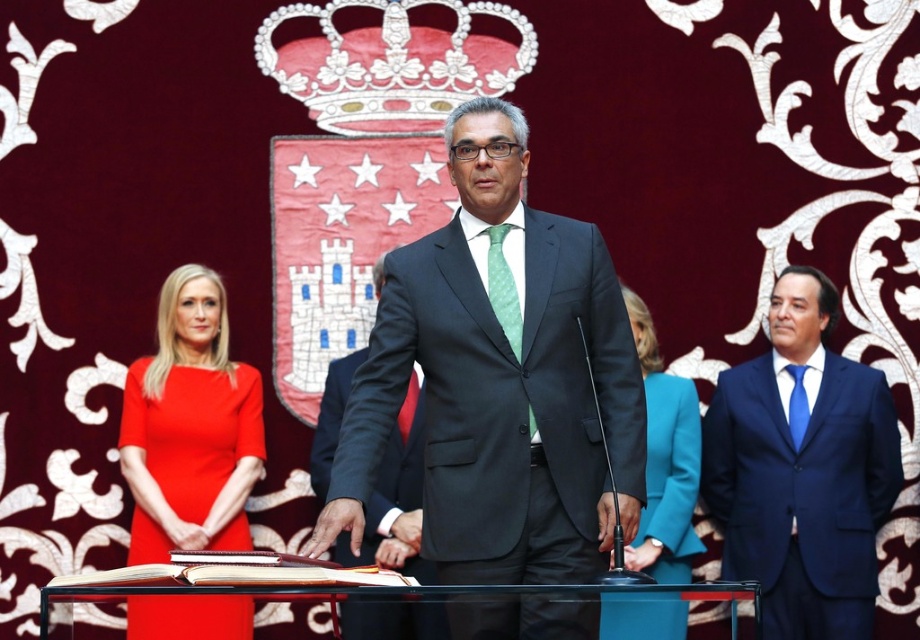
Is blue satin suit at right shorter than teal fabric jacket at lower center?

In fact, blue satin suit at right may be taller than teal fabric jacket at lower center.

How much distance is there between blue satin suit at right and teal fabric jacket at lower center?

A distance of 4.61 meters exists between blue satin suit at right and teal fabric jacket at lower center.

Locate an element on the screen. This screenshot has width=920, height=640. blue satin suit at right is located at coordinates (802, 472).

Locate an element on the screen. The height and width of the screenshot is (640, 920). blue satin suit at right is located at coordinates (802, 472).

Image resolution: width=920 pixels, height=640 pixels. What do you see at coordinates (500, 381) in the screenshot?
I see `matte black suit at center` at bounding box center [500, 381].

Identify the location of matte black suit at center. The width and height of the screenshot is (920, 640). (500, 381).

Does white textured crown at upper center have a greater width compared to teal fabric jacket at lower center?

Yes.

Which is above, white textured crown at upper center or teal fabric jacket at lower center?

white textured crown at upper center

You are a GUI agent. You are given a task and a screenshot of the screen. Output one action in this format:
    pyautogui.click(x=<x>, y=<y>)
    Task: Click on the white textured crown at upper center
    
    Given the screenshot: What is the action you would take?
    pyautogui.click(x=392, y=65)

In order to click on white textured crown at upper center in this screenshot , I will do `click(392, 65)`.